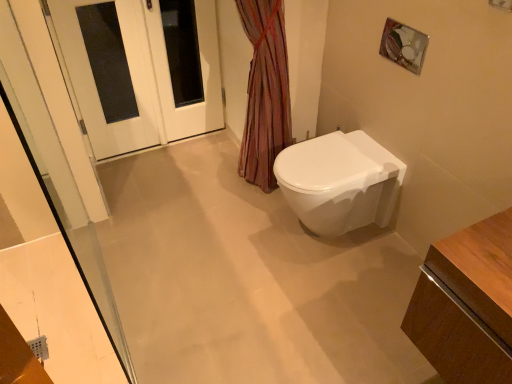
In order to click on white glossy toilet at center-right in this screenshot , I will do `click(339, 182)`.

What do you see at coordinates (141, 70) in the screenshot? This screenshot has width=512, height=384. I see `white glossy door at upper left` at bounding box center [141, 70].

Where is `white glossy toilet at center-right`? This screenshot has height=384, width=512. white glossy toilet at center-right is located at coordinates (x=339, y=182).

From a real-world perspective, does white glossy door at upper left stand above white glossy toilet at center-right?

Yes.

Considering the points (205, 95) and (385, 200), which point is in front, point (205, 95) or point (385, 200)?

The point (385, 200) is closer.

Can you confirm if white glossy door at upper left is taller than white glossy toilet at center-right?

Yes, white glossy door at upper left is taller than white glossy toilet at center-right.

What's the angular difference between white glossy door at upper left and white glossy toilet at center-right's facing directions?

white glossy door at upper left and white glossy toilet at center-right are facing 90.1 degrees away from each other.

Which of these two, white glossy door at upper left or white glossy toilet at center-right, stands shorter?

white glossy toilet at center-right.

From a real-world perspective, is white glossy door at upper left on white glossy toilet at center-right?

Yes.

Considering the relative sizes of white glossy toilet at center-right and white glossy door at upper left in the image provided, is white glossy toilet at center-right thinner than white glossy door at upper left?

No.

From a real-world perspective, who is located lower, white glossy toilet at center-right or white glossy door at upper left?

From a 3D spatial view, white glossy toilet at center-right is below.

Is point (304, 143) in front of point (213, 54)?

That is True.

From the image's perspective, is white glossy toilet at center-right positioned above or below white glossy door at upper left?

Based on their image positions, white glossy toilet at center-right is located beneath white glossy door at upper left.

From the image's perspective, is white glossy toilet at center-right on white glossy door at upper left?

No, from the image's perspective, white glossy toilet at center-right is not on top of white glossy door at upper left.

Considering the relative sizes of white glossy toilet at center-right and white glossy door at upper left in the image provided, is white glossy toilet at center-right wider than white glossy door at upper left?

Indeed, white glossy toilet at center-right has a greater width compared to white glossy door at upper left.

Is white glossy toilet at center-right outside of white glossy door at upper left?

Indeed, white glossy toilet at center-right is completely outside white glossy door at upper left.

Which is closer to the camera, [349,193] or [210,63]?

The point [349,193] is closer to the camera.

Which is behind, point (165, 102) or point (56, 18)?

The point (165, 102) is farther from the camera.

How many degrees apart are the facing directions of white glossy door at upper left and white glossy door at upper left?

0.00633 degrees.

From a real-world perspective, is white glossy door at upper left positioned under white glossy door at upper left based on gravity?

Correct, in the physical world, white glossy door at upper left is lower than white glossy door at upper left.

Is white glossy door at upper left not inside white glossy door at upper left?

No, most part of white glossy door at upper left lies within white glossy door at upper left.

Is white glossy door at upper left taller than white glossy door at upper left?

Correct, white glossy door at upper left is much taller as white glossy door at upper left.

The image size is (512, 384). Find the location of `door above the white glossy door at upper left (from a real-world perspective)`. door above the white glossy door at upper left (from a real-world perspective) is located at coordinates 141,70.

Does point (142, 117) appear closer or farther from the camera than point (218, 102)?

Clearly, point (142, 117) is closer to the camera than point (218, 102).

The width and height of the screenshot is (512, 384). What are the coordinates of `door above the white glossy toilet at center-right (from a real-world perspective)` in the screenshot? It's located at click(141, 70).

Where is `toilet that is below the white glossy door at upper left (from the image's perspective)`? This screenshot has height=384, width=512. toilet that is below the white glossy door at upper left (from the image's perspective) is located at coordinates (339, 182).

Based on their spatial positions, is white glossy door at upper left or white glossy door at upper left further from white glossy toilet at center-right?

white glossy door at upper left.

Based on their spatial positions, is white glossy door at upper left or white glossy door at upper left closer to white glossy toilet at center-right?

white glossy door at upper left is closer to white glossy toilet at center-right.

When comparing their distances from white glossy door at upper left, does white glossy toilet at center-right or white glossy door at upper left seem closer?

white glossy door at upper left lies closer to white glossy door at upper left than the other object.

Considering their positions, is white glossy door at upper left positioned further to white glossy door at upper left than white glossy toilet at center-right?

white glossy toilet at center-right.

Looking at the image, which one is located further to white glossy door at upper left, white glossy toilet at center-right or white glossy door at upper left?

white glossy toilet at center-right is further to white glossy door at upper left.

When comparing their distances from white glossy door at upper left, does white glossy door at upper left or white glossy toilet at center-right seem further?

Based on the image, white glossy toilet at center-right appears to be further to white glossy door at upper left.

At what (x,y) coordinates should I click in order to perform the action: click on screen door located between white glossy door at upper left and white glossy toilet at center-right in the left-right direction. Please return your answer as a coordinate pair (x, y). The width and height of the screenshot is (512, 384). Looking at the image, I should click on (200, 79).